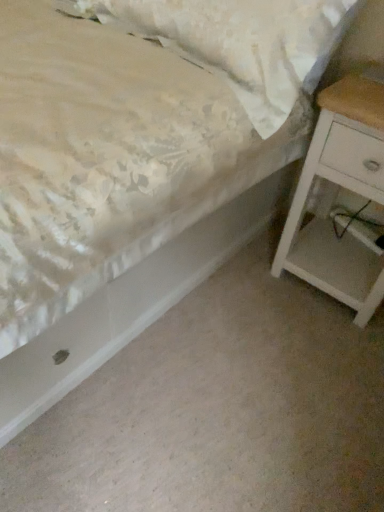
This screenshot has width=384, height=512. I want to click on vacant space in front of white matte nightstand at right, so click(x=322, y=354).